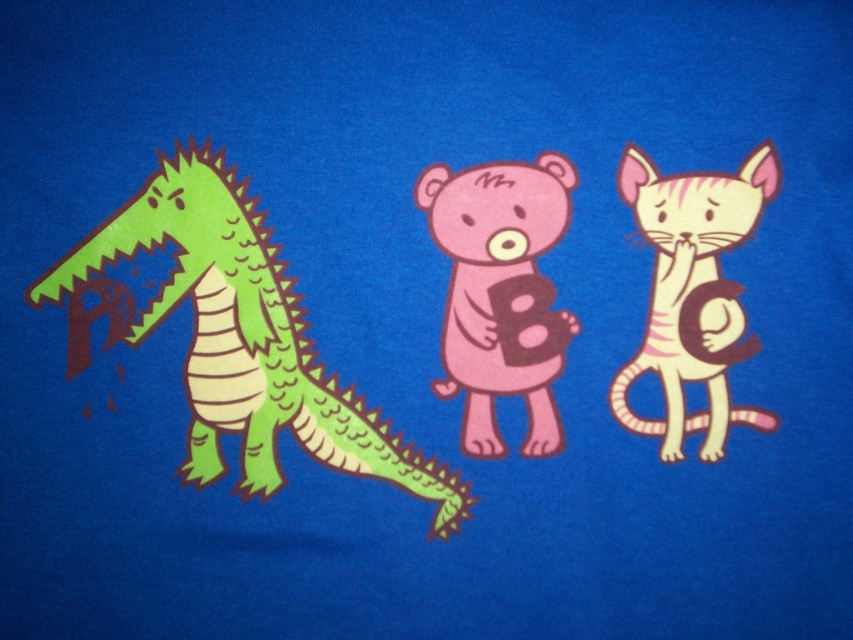
Question: Does green matte/dull dragon at left appear over white striped fur cat at right?

Choices:
 (A) no
 (B) yes

Answer: (A)

Question: Can you confirm if green matte/dull dragon at left is positioned below white striped fur cat at right?

Choices:
 (A) yes
 (B) no

Answer: (A)

Question: Which of these objects is positioned closest to the pink matte bear at center?

Choices:
 (A) green matte/dull dragon at left
 (B) white striped fur cat at right

Answer: (B)

Question: Which object is closer to the camera taking this photo?

Choices:
 (A) white striped fur cat at right
 (B) pink matte bear at center

Answer: (A)

Question: Which point is closer to the camera taking this photo?

Choices:
 (A) (664, 179)
 (B) (434, 173)
 (C) (236, 280)

Answer: (A)

Question: Can you confirm if green matte/dull dragon at left is smaller than pink matte bear at center?

Choices:
 (A) no
 (B) yes

Answer: (A)